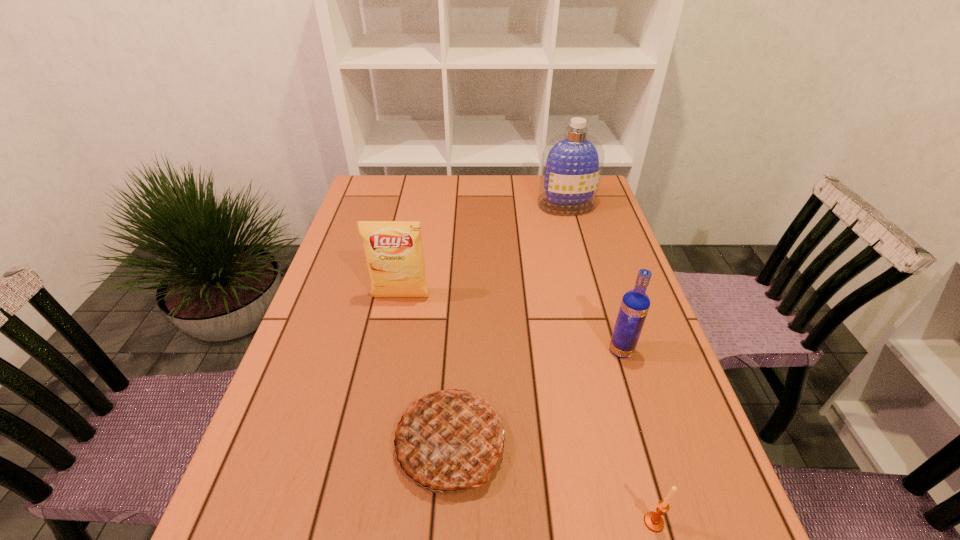
Image resolution: width=960 pixels, height=540 pixels. Find the location of `vacant space at the left edge`. vacant space at the left edge is located at coordinates (350, 317).

This screenshot has height=540, width=960. Find the location of `blank area at the right edge`. blank area at the right edge is located at coordinates (573, 267).

I want to click on vacant space at the far left corner of the desktop, so click(374, 210).

This screenshot has width=960, height=540. I want to click on vacant space at the far right corner of the desktop, so click(x=606, y=200).

I want to click on unoccupied area between the candle_holder and the third farthest object, so click(x=637, y=436).

Locate an element on the screen. The width and height of the screenshot is (960, 540). free spot between the fourth nearest object and the fourth farthest object is located at coordinates (425, 370).

At what (x,y) coordinates should I click in order to perform the action: click on empty space between the third farthest object and the crisp (potato chip). Please return your answer as a coordinate pair (x, y). Looking at the image, I should click on (511, 324).

Find the location of a particular element. The image size is (960, 540). free space between the vodka and the cleansing agent is located at coordinates (593, 278).

The image size is (960, 540). What are the coordinates of `vacant space in between the third farthest object and the candle_holder` in the screenshot? It's located at (637, 436).

This screenshot has width=960, height=540. I want to click on free area in between the pie and the crisp (potato chip), so click(425, 370).